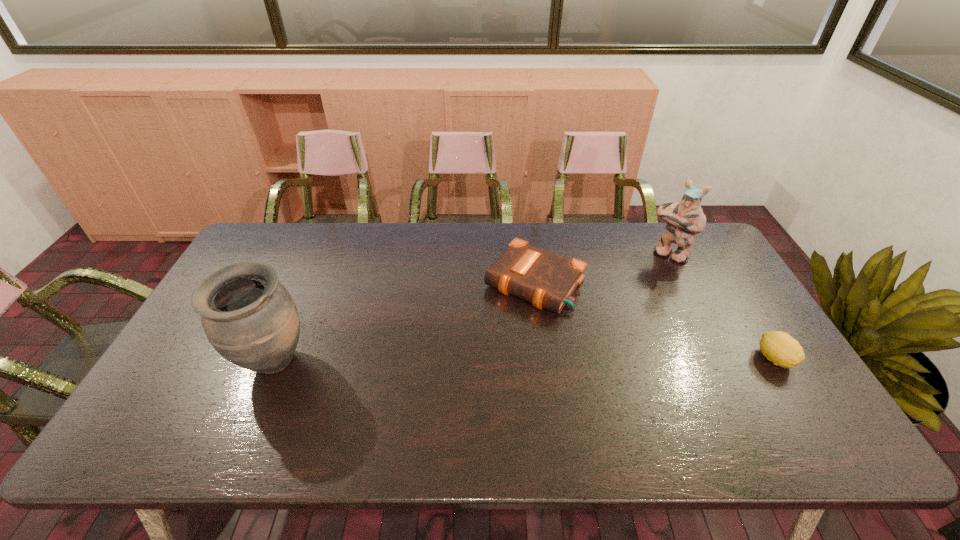
This screenshot has width=960, height=540. What are the coordinates of `the leftmost object` in the screenshot? It's located at (249, 317).

Where is `the rightmost object`? Image resolution: width=960 pixels, height=540 pixels. the rightmost object is located at coordinates (780, 348).

This screenshot has width=960, height=540. What are the coordinates of `the third object from right to left` in the screenshot? It's located at (547, 280).

This screenshot has width=960, height=540. Find the location of `the third object from left to right`. the third object from left to right is located at coordinates (684, 219).

Find the location of a particular element. Image resolution: width=960 pixels, height=540 pixels. free space located on the left of the urn is located at coordinates (179, 363).

At what (x,y) coordinates should I click in order to perform the action: click on vacant region located at the stem end of the lemon. Please return your answer as a coordinate pair (x, y). The height and width of the screenshot is (540, 960). Looking at the image, I should click on (798, 396).

At what (x,y) coordinates should I click in order to perform the action: click on free space located on the spine side of the Bible. Please return your answer as a coordinate pair (x, y). Looking at the image, I should click on (437, 409).

The width and height of the screenshot is (960, 540). What are the coordinates of `vacant space located 0.190m on the spine side of the Bible` in the screenshot? It's located at (476, 358).

Find the location of `free space located on the spine side of the Bible`. free space located on the spine side of the Bible is located at coordinates (493, 336).

Where is `vacant space located 0.310m on the front-facing side of the figurine`? vacant space located 0.310m on the front-facing side of the figurine is located at coordinates click(x=617, y=315).